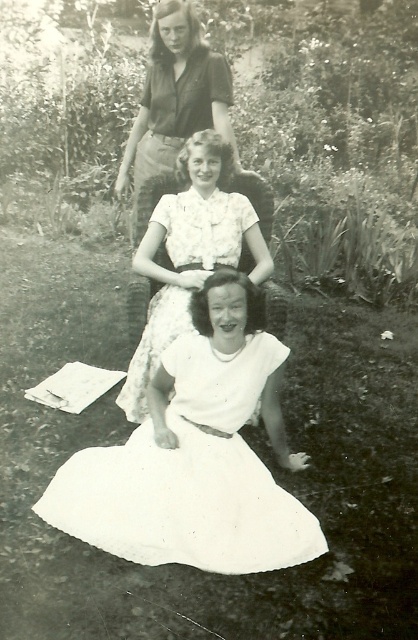
Between white cotton dress at lower center and white satin dress at center, which one is positioned higher?

white satin dress at center is higher up.

Locate an element on the screen. This screenshot has width=418, height=640. white cotton dress at lower center is located at coordinates (190, 476).

Describe the element at coordinates (190, 476) in the screenshot. Image resolution: width=418 pixels, height=640 pixels. I see `white cotton dress at lower center` at that location.

Locate an element on the screen. white cotton dress at lower center is located at coordinates (190, 476).